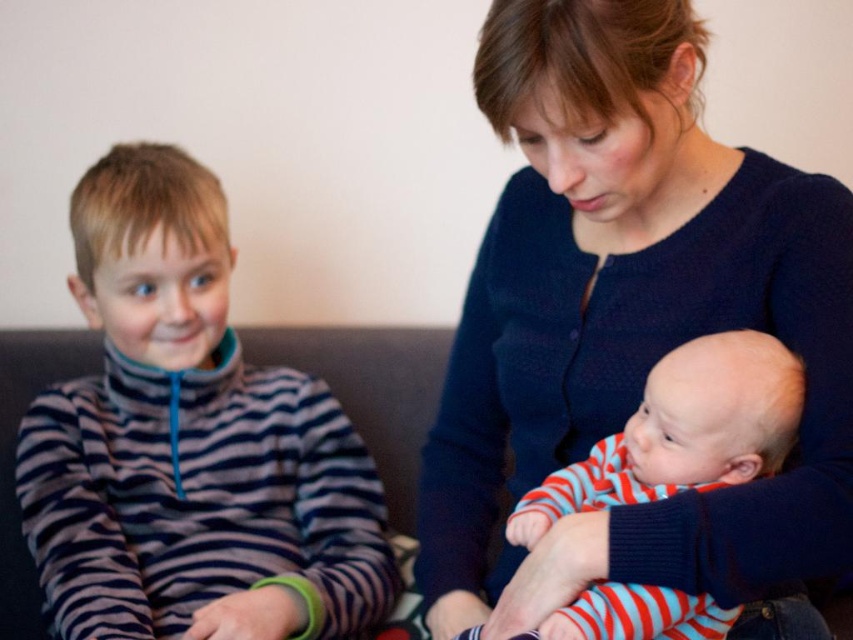
Question: Which point is farther to the camera?

Choices:
 (A) striped fabric shirt at left
 (B) blue textured sweater at center

Answer: (A)

Question: Among these points, which one is nearest to the camera?

Choices:
 (A) (735, 355)
 (B) (316, 400)
 (C) (577, 404)

Answer: (A)

Question: Is blue textured sweater at center behind striped cotton baby at center?

Choices:
 (A) no
 (B) yes

Answer: (A)

Question: Is blue textured sweater at center thinner than striped cotton baby at center?

Choices:
 (A) yes
 (B) no

Answer: (B)

Question: Is the position of blue textured sweater at center less distant than that of striped fabric shirt at left?

Choices:
 (A) no
 (B) yes

Answer: (B)

Question: Among these points, which one is nearest to the camera?

Choices:
 (A) click(x=645, y=500)
 (B) click(x=643, y=88)

Answer: (B)